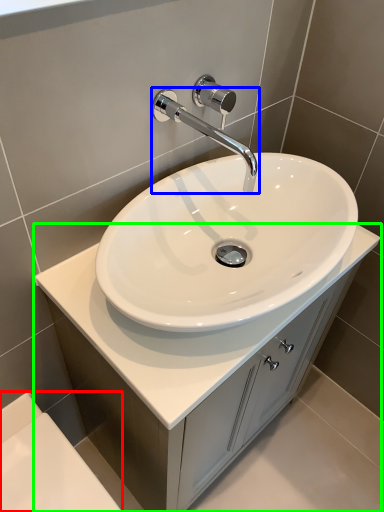
Question: Considering the real-world distances, which object is closest to bath (highlighted by a red box)? tap (highlighted by a blue box) or bathroom cabinet (highlighted by a green box).

Choices:
 (A) tap
 (B) bathroom cabinet

Answer: (B)